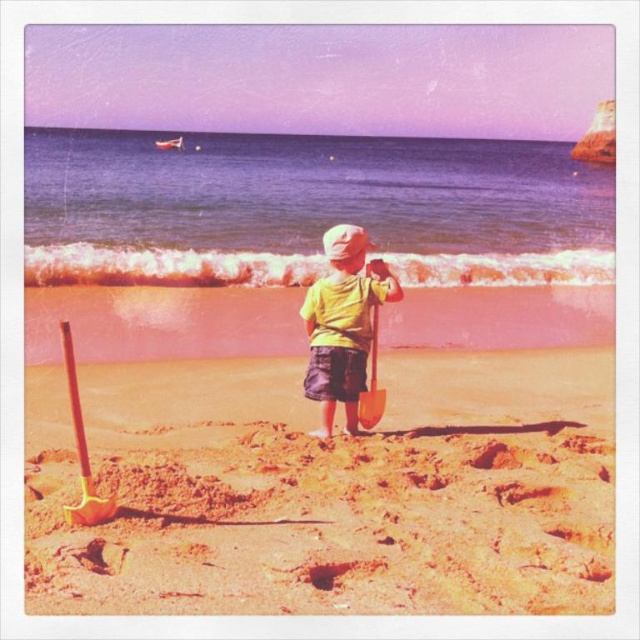
You are a photographer trying to capture the child in the scene. You want to ensure the yellow matte shirt at center and the metallic gold shovel at center are both visible in the frame. Which object should you position closer to the left side of the camera frame?

The yellow matte shirt at center should be positioned closer to the left side of the camera frame because it is already on the left side of the metallic gold shovel at center.

You are standing at the point marked by coordinates point at (364, 321). You want to walk directly towards the viewer. How far will you have to walk to reach the viewer?

The distance between point at (364, 321) and the viewer is 17.30 feet, so you will have to walk 17.30 feet to reach the viewer.